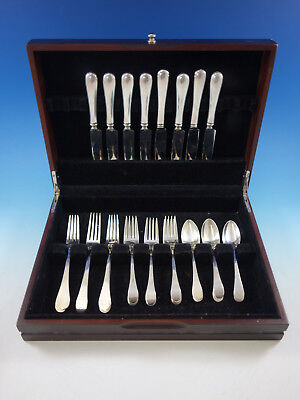
Find the location of a particular element. Image resolution: width=300 pixels, height=400 pixels. knives is located at coordinates (93, 129), (111, 126), (125, 128), (141, 127), (159, 127), (178, 127), (193, 127), (209, 126).